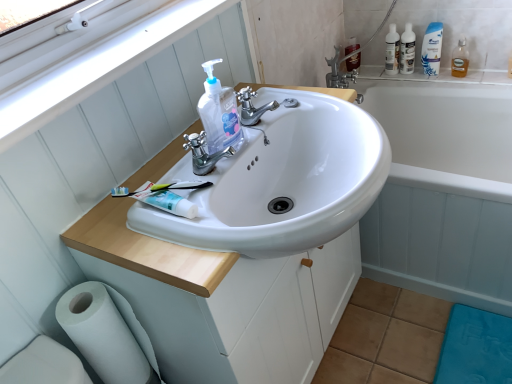
The image size is (512, 384). What are the coordinates of `free region on the left part of translucent plastic mouthwash at upper right, which is counted as the 1th mouthwash, starting from the right` in the screenshot? It's located at (426, 73).